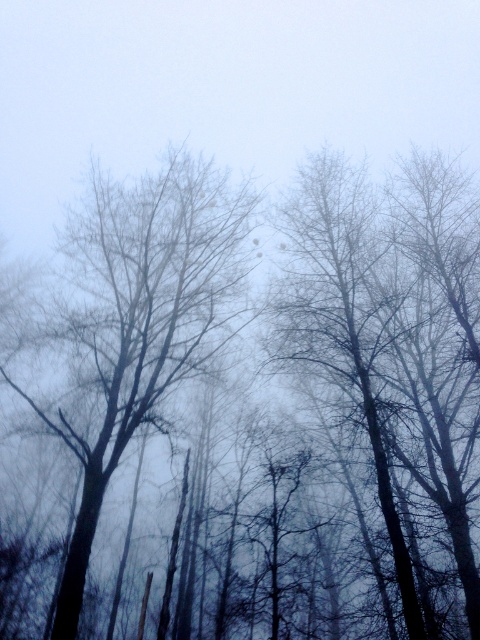
Who is positioned more to the left, dark brown bark tree at center or bare branches at center?

bare branches at center is more to the left.

In the scene shown: Does dark brown bark tree at center have a greater height compared to bare branches at center?

Indeed, dark brown bark tree at center has a greater height compared to bare branches at center.

This screenshot has height=640, width=480. What do you see at coordinates (396, 356) in the screenshot? I see `dark brown bark tree at center` at bounding box center [396, 356].

The width and height of the screenshot is (480, 640). I want to click on dark brown bark tree at center, so click(x=396, y=356).